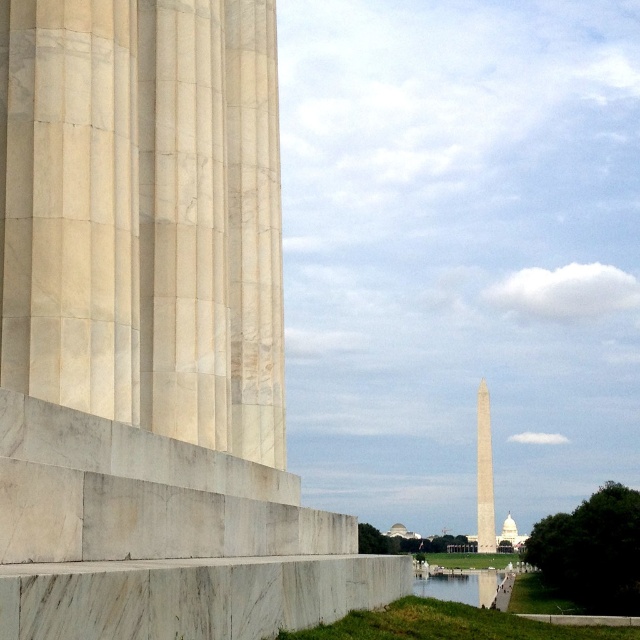
Can you confirm if white marble column at left is taller than white marble obelisk at center?

No.

How far apart are white marble column at left and white marble obelisk at center?

218.98 meters

I want to click on white marble column at left, so click(150, 333).

The image size is (640, 640). In order to click on white marble column at left in this screenshot , I will do `click(150, 333)`.